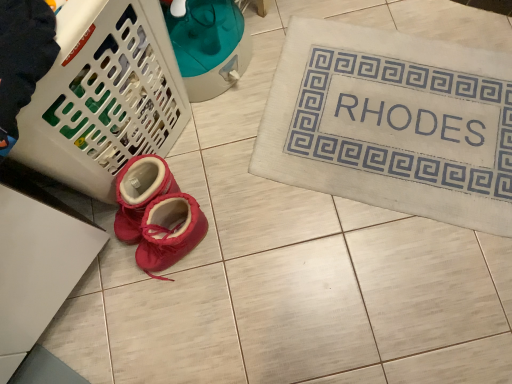
Question: From a real-world perspective, is white plastic laundry basket at lower left physically located above or below matte pink booties at center?

Choices:
 (A) above
 (B) below

Answer: (A)

Question: Is white plastic laundry basket at lower left situated inside matte pink booties at center or outside?

Choices:
 (A) outside
 (B) inside

Answer: (A)

Question: Which of these objects is positioned farthest from the white plastic laundry basket at lower left?

Choices:
 (A) matte pink booties at center
 (B) beige fabric bath mat at upper right

Answer: (B)

Question: Based on their relative distances, which object is nearer to the beige fabric bath mat at upper right?

Choices:
 (A) matte pink booties at center
 (B) white plastic laundry basket at lower left

Answer: (A)